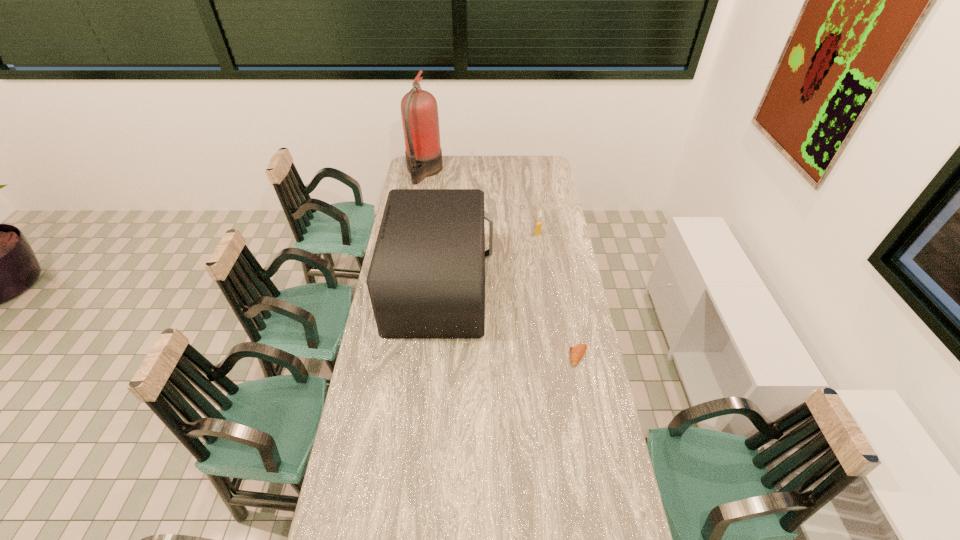
Identify which object is the nearest to the fire extinguisher. Please provide its 2D coordinates. Your answer should be formatted as a tuple, i.e. [(x, y)], where the tuple contains the x and y coordinates of a point satisfying the conditions above.

[(426, 280)]

The image size is (960, 540). Find the location of `vacant space that satisfies the following two spatial constraints: 1. on the front side of the rightmost object; 2. on the left side of the third object from left to right`. vacant space that satisfies the following two spatial constraints: 1. on the front side of the rightmost object; 2. on the left side of the third object from left to right is located at coordinates (556, 356).

The image size is (960, 540). Identify the location of blank area in the image that satisfies the following two spatial constraints: 1. at the nozzle of the fire extinguisher; 2. on the back side of the rightmost object. (394, 356).

The height and width of the screenshot is (540, 960). Identify the location of vacant region that satisfies the following two spatial constraints: 1. at the nozzle of the tallest object; 2. on the left side of the second object from right to left. (414, 234).

This screenshot has height=540, width=960. Identify the location of vacant space that satisfies the following two spatial constraints: 1. on the front-facing side of the third farthest object; 2. on the back side of the shortest object. (433, 356).

I want to click on vacant point that satisfies the following two spatial constraints: 1. at the nozzle of the tallest object; 2. on the left side of the rightmost object, so (394, 356).

This screenshot has height=540, width=960. I want to click on vacant space that satisfies the following two spatial constraints: 1. on the front side of the nearest object; 2. on the left side of the second shortest object, so click(x=556, y=356).

Locate an element on the screen. The width and height of the screenshot is (960, 540). vacant area in the image that satisfies the following two spatial constraints: 1. on the front-facing side of the third shortest object; 2. on the left side of the rightmost object is located at coordinates (433, 356).

The width and height of the screenshot is (960, 540). What are the coordinates of `vacant space that satisfies the following two spatial constraints: 1. on the front-facing side of the rightmost object; 2. on the right side of the second nearest object` in the screenshot? It's located at (433, 356).

Find the location of a particular element. The height and width of the screenshot is (540, 960). vacant space that satisfies the following two spatial constraints: 1. on the front-facing side of the nearest object; 2. on the right side of the microwave oven is located at coordinates (433, 356).